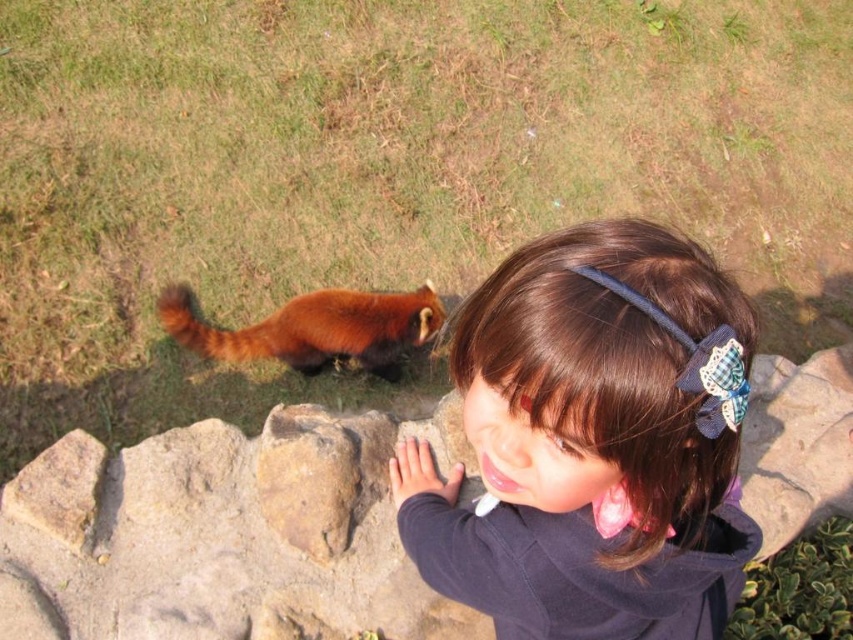
Question: Is the position of brown hair at upper right less distant than that of fluffy reddish-brown animal at lower left?

Choices:
 (A) no
 (B) yes

Answer: (B)

Question: Is brown hair at upper right positioned before brown rough stone at lower center?

Choices:
 (A) yes
 (B) no

Answer: (A)

Question: Which point is farther to the camera?

Choices:
 (A) brown rough stone at lower center
 (B) fluffy reddish-brown animal at lower left

Answer: (B)

Question: Which of the following is the farthest from the observer?

Choices:
 (A) (223, 465)
 (B) (682, 301)
 (C) (434, 316)

Answer: (C)

Question: Among these points, which one is farthest from the camera?

Choices:
 (A) (691, 268)
 (B) (97, 508)

Answer: (B)

Question: Can you confirm if brown rough stone at lower center is wider than fluffy reddish-brown animal at lower left?

Choices:
 (A) yes
 (B) no

Answer: (A)